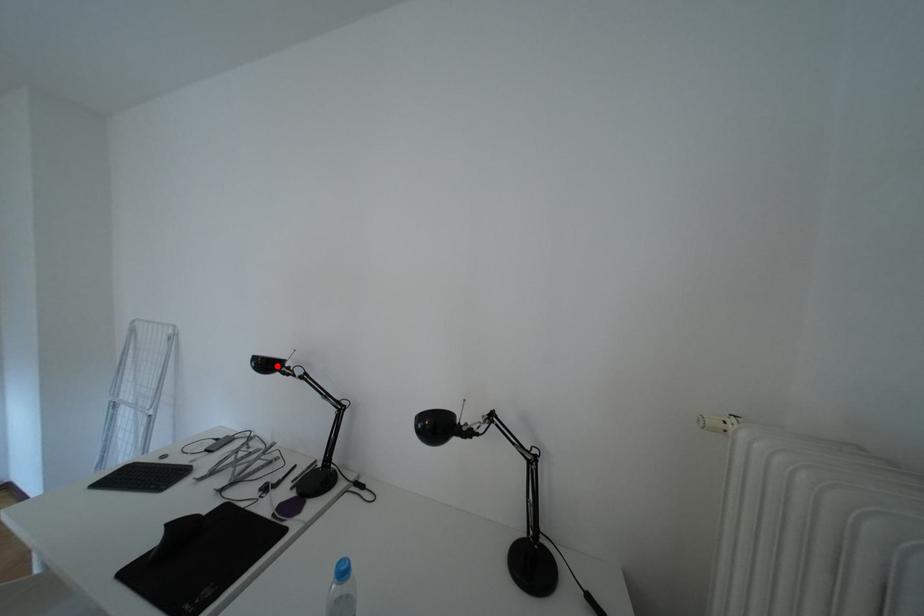
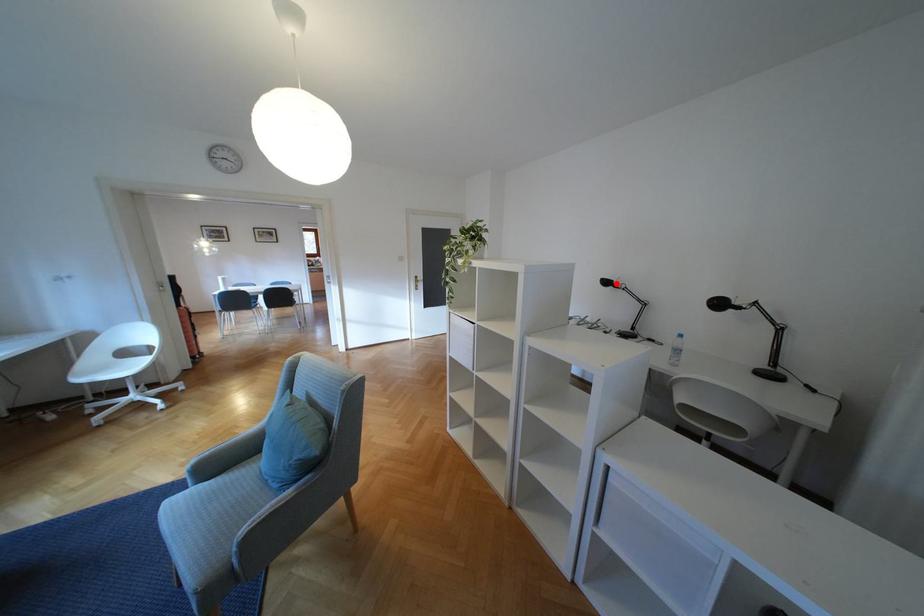
I am providing you with two images of the same scene from different viewpoints. A red point is marked on the first image and another point is marked on the second image. Do the highlighted points in image1 and image2 indicate the same real-world spot?

Yes